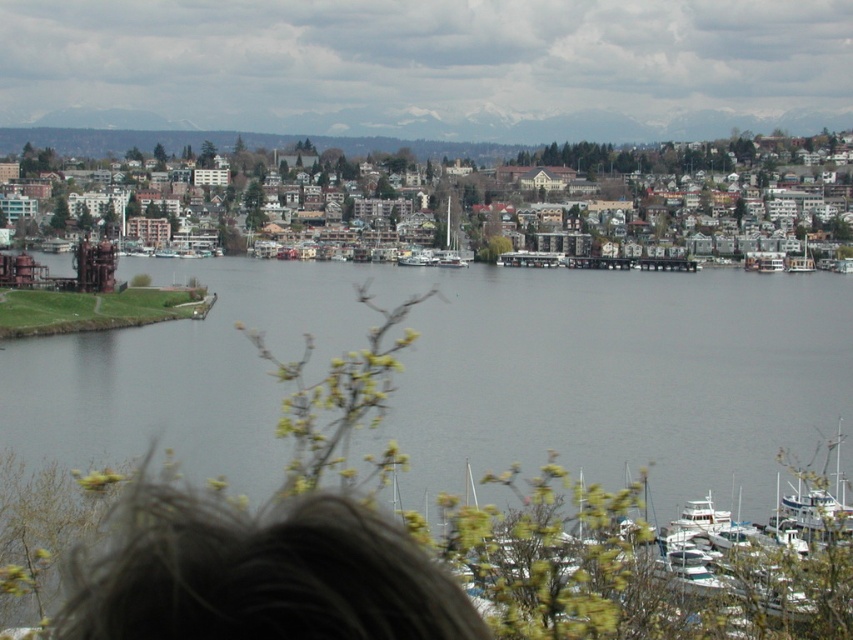
Is point (479, 148) closer to viewer compared to point (697, 509)?

No, (479, 148) is further to viewer.

Who is taller, brown wooden houses at center or white glossy boat at lower right?

Standing taller between the two is brown wooden houses at center.

Which is behind, point (370, 140) or point (686, 513)?

The point (370, 140) is behind.

At what (x,y) coordinates should I click in order to perform the action: click on brown wooden houses at center. Please return your answer as a coordinate pair (x, y). Looking at the image, I should click on pos(601,154).

Can you confirm if gray water at center is bigger than white glossy boat at lower right?

Yes, gray water at center is bigger than white glossy boat at lower right.

Is gray water at center in front of white glossy boat at lower right?

No, gray water at center is behind white glossy boat at lower right.

Is point (759, 374) positioned in front of point (711, 525)?

No, it is not.

Identify the location of gray water at center. The image size is (853, 640). 469,372.

Which of these two, gray water at center or white glossy sailboat at center, stands shorter?

white glossy sailboat at center is shorter.

Can you confirm if gray water at center is positioned to the right of white glossy sailboat at center?

Incorrect, gray water at center is not on the right side of white glossy sailboat at center.

Which is in front, point (132, 445) or point (444, 262)?

Positioned in front is point (132, 445).

I want to click on gray water at center, so click(x=469, y=372).